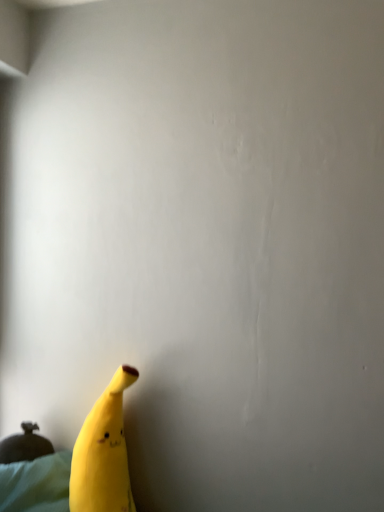
Question: In the image, is yellow matte banana at lower left positioned in front of or behind matte green sheet at lower left?

Choices:
 (A) front
 (B) behind

Answer: (A)

Question: Is point (109, 493) closer or farther from the camera than point (23, 492)?

Choices:
 (A) closer
 (B) farther

Answer: (A)

Question: In the image, is yellow matte banana at lower left on the left side or the right side of matte green sheet at lower left?

Choices:
 (A) left
 (B) right

Answer: (B)

Question: Considering the relative positions of matte green sheet at lower left and yellow matte banana at lower left in the image provided, is matte green sheet at lower left to the left or to the right of yellow matte banana at lower left?

Choices:
 (A) left
 (B) right

Answer: (A)

Question: From a real-world perspective, is matte green sheet at lower left positioned above or below yellow matte banana at lower left?

Choices:
 (A) above
 (B) below

Answer: (B)

Question: Considering the positions of matte green sheet at lower left and yellow matte banana at lower left in the image, is matte green sheet at lower left wider or thinner than yellow matte banana at lower left?

Choices:
 (A) thin
 (B) wide

Answer: (A)

Question: From the image's perspective, relative to yellow matte banana at lower left, is matte green sheet at lower left above or below?

Choices:
 (A) above
 (B) below

Answer: (B)